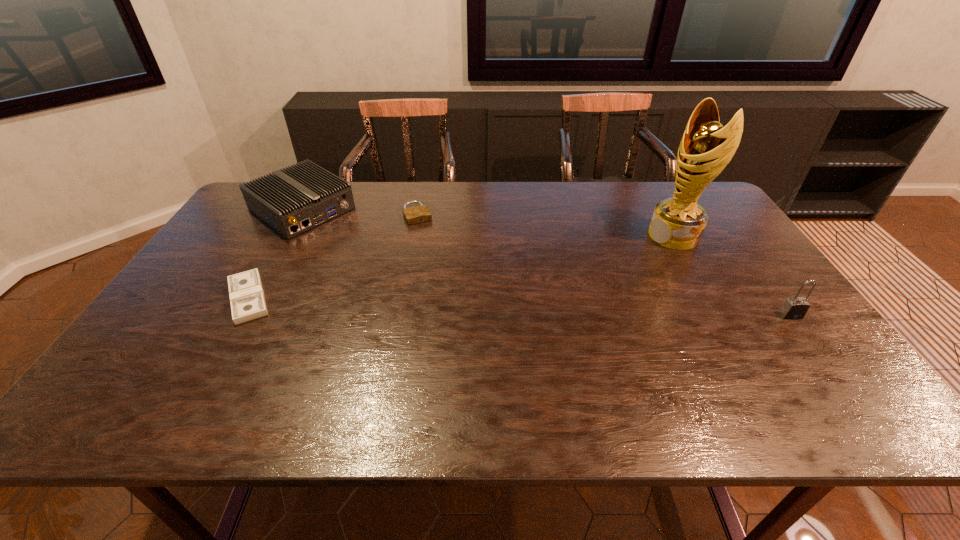
Identify the location of free spot between the tallest object and the second tallest object. This screenshot has width=960, height=540. (732, 275).

Image resolution: width=960 pixels, height=540 pixels. I want to click on the second closest object to the award, so click(417, 214).

Identify which object is the second closest to the third tallest object. Please provide its 2D coordinates. Your answer should be formatted as a tuple, i.e. [(x, y)], where the tuple contains the x and y coordinates of a point satisfying the conditions above.

[(417, 214)]

Image resolution: width=960 pixels, height=540 pixels. Find the location of `free spot that satisfies the following two spatial constraints: 1. on the front side of the award; 2. on the right side of the farther padlock`. free spot that satisfies the following two spatial constraints: 1. on the front side of the award; 2. on the right side of the farther padlock is located at coordinates coord(414,235).